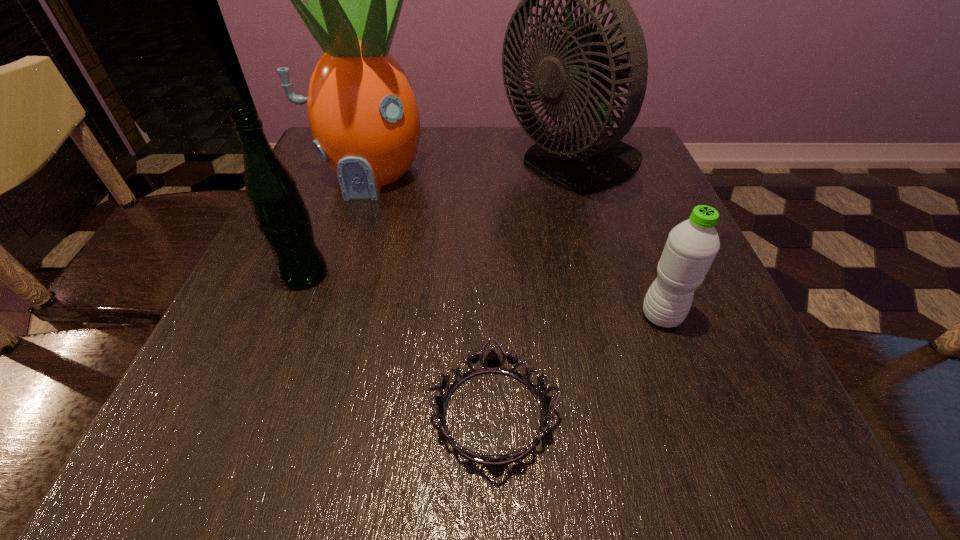
This screenshot has width=960, height=540. I want to click on vacant space at the far right corner, so click(x=649, y=168).

You are a GUI agent. You are given a task and a screenshot of the screen. Output one action in this format:
    pyautogui.click(x=<x>, y=<y>)
    Task: Click on the free spot between the pineapple and the water bottle
    The width and height of the screenshot is (960, 540).
    Given the screenshot: What is the action you would take?
    pyautogui.click(x=515, y=245)

This screenshot has width=960, height=540. Find the location of `unoccupied area between the beer bottle and the fan`. unoccupied area between the beer bottle and the fan is located at coordinates (439, 220).

This screenshot has width=960, height=540. I want to click on free spot between the pineapple and the third farthest object, so click(336, 224).

Locate an element on the screen. The width and height of the screenshot is (960, 540). vacant area that lies between the third shortest object and the pineapple is located at coordinates 336,224.

Where is `vacant space that's between the fan and the pineapple`? vacant space that's between the fan and the pineapple is located at coordinates [x=470, y=170].

Identify the location of empty space between the shortest object and the pineapple. This screenshot has height=540, width=960. (430, 294).

Find the location of a particular element. The image size is (960, 540). free space that is in between the fan and the fourth farthest object is located at coordinates (617, 241).

Find the location of a particular element. The image size is (960, 540). free space between the fan and the fourth farthest object is located at coordinates (617, 241).

Locate an element on the screen. free space between the third tallest object and the tiara is located at coordinates (398, 344).